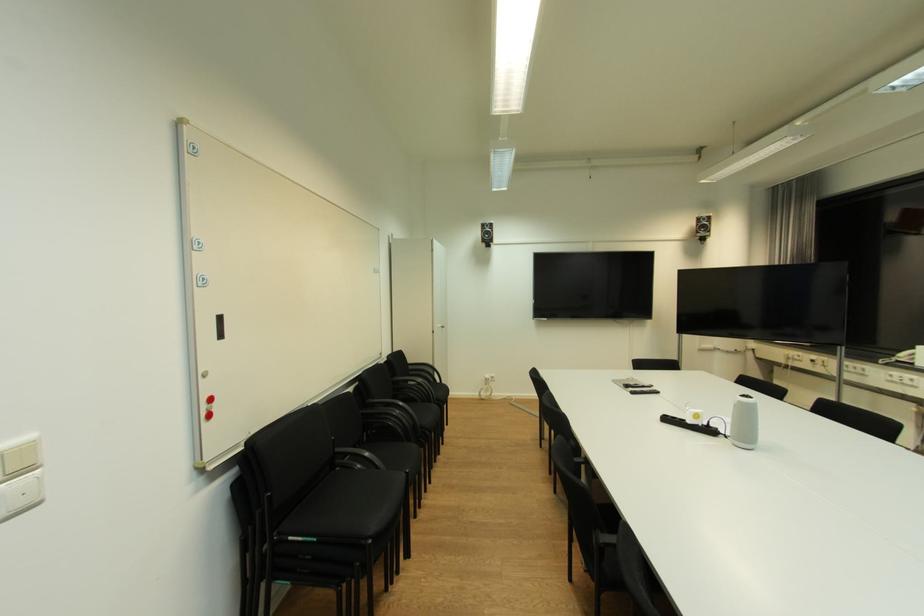
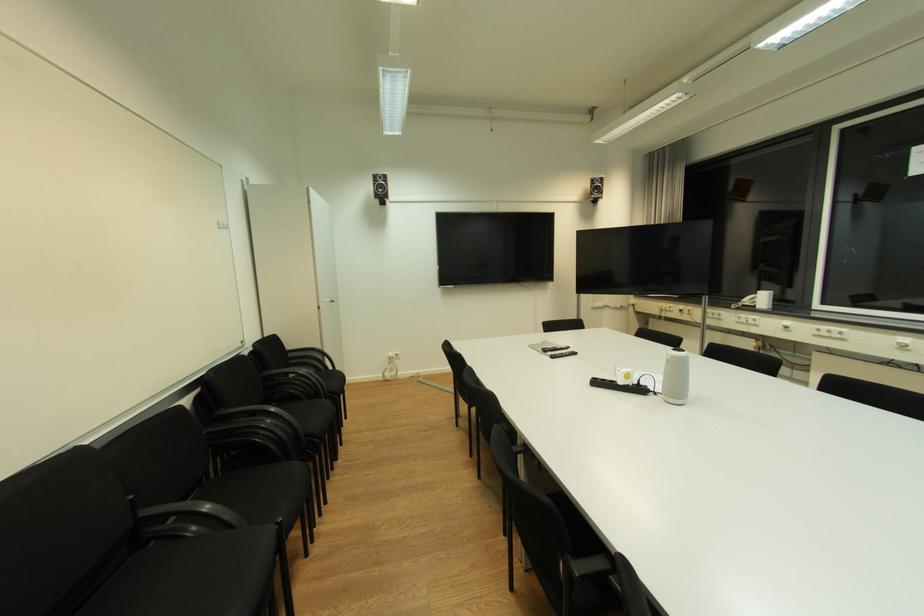
Locate, in the second image, the point that corresponds to pixel 445 326 in the first image.

(334, 301)